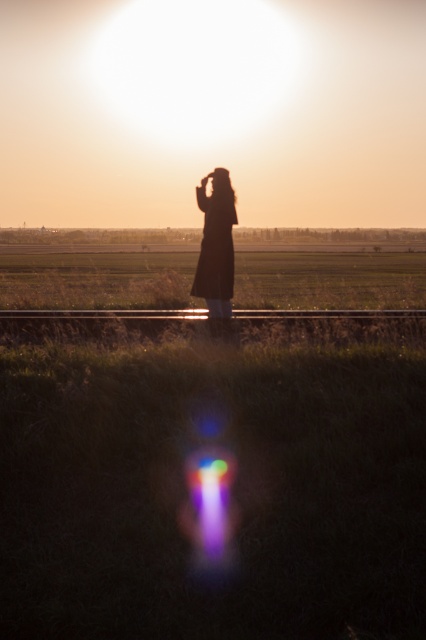
You are standing in the rural scene and want to place a small flag at the closest point to the camera between point (213, 230) and point (288, 308). Which point should you choose?

You should choose point (213, 230) because it is closer to the camera than point (288, 308).

You are a photographer trying to capture the silhouette of the silhouette coat at center and the metallic train track at center in the same frame. Based on their positions, which object will appear larger in your photo?

The silhouette coat at center will appear larger in the photo because it is closer to the viewer than the metallic train track at center.

You are a photographer trying to capture the silhouette of the silhouette coat at center and the metallic train track at center in the same frame. Based on their positions, which object should you focus on first to ensure both are in the shot?

The silhouette coat at center is positioned on the left side of the metallic train track at center, so you should focus on the metallic train track at center first to ensure both the silhouette coat at center and the metallic train track at center are in the frame.